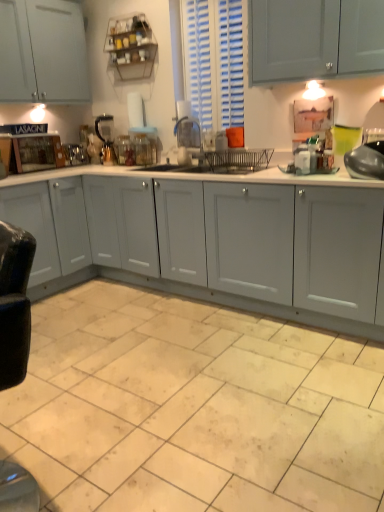
Question: Is shiny metallic pot at right, the fifth appliance in the back-to-front sequence, closer to the viewer compared to teal glass at upper right?

Choices:
 (A) yes
 (B) no

Answer: (A)

Question: Does shiny metallic pot at right, marked as the 1th appliance in a front-to-back arrangement, contain teal glass at upper right?

Choices:
 (A) yes
 (B) no

Answer: (B)

Question: Can you confirm if shiny metallic pot at right, the fifth appliance in the back-to-front sequence, is shorter than teal glass at upper right?

Choices:
 (A) yes
 (B) no

Answer: (A)

Question: Is shiny metallic pot at right, marked as the 1th appliance in a right-to-left arrangement, behind teal glass at upper right?

Choices:
 (A) yes
 (B) no

Answer: (B)

Question: Does shiny metallic pot at right, marked as the 1th appliance in a right-to-left arrangement, turn towards teal glass at upper right?

Choices:
 (A) yes
 (B) no

Answer: (B)

Question: Looking at the image, does metallic silver kettle at center, acting as the second appliance starting from the back, seem bigger or smaller compared to teal glass at upper right?

Choices:
 (A) small
 (B) big

Answer: (B)

Question: Considering the positions of metallic silver kettle at center, which is counted as the 4th appliance, starting from the right, and teal glass at upper right in the image, is metallic silver kettle at center, which is counted as the 4th appliance, starting from the right, wider or thinner than teal glass at upper right?

Choices:
 (A) wide
 (B) thin

Answer: (A)

Question: Considering the positions of metallic silver kettle at center, acting as the second appliance starting from the back, and teal glass at upper right in the image, is metallic silver kettle at center, acting as the second appliance starting from the back, taller or shorter than teal glass at upper right?

Choices:
 (A) short
 (B) tall

Answer: (B)

Question: Does point (96, 130) appear closer or farther from the camera than point (354, 139)?

Choices:
 (A) closer
 (B) farther

Answer: (B)

Question: Considering the positions of shiny metallic pot at right, marked as the 1th appliance in a front-to-back arrangement, and clear glass jar at center, the third appliance viewed from the right, in the image, is shiny metallic pot at right, marked as the 1th appliance in a front-to-back arrangement, bigger or smaller than clear glass jar at center, the third appliance viewed from the right,?

Choices:
 (A) big
 (B) small

Answer: (A)

Question: In terms of height, does shiny metallic pot at right, marked as the 1th appliance in a right-to-left arrangement, look taller or shorter compared to clear glass jar at center, placed as the third appliance when sorted from back to front?

Choices:
 (A) tall
 (B) short

Answer: (B)

Question: Choose the correct answer: Is shiny metallic pot at right, the fifth appliance in the back-to-front sequence, inside clear glass jar at center, the third appliance viewed from the right, or outside it?

Choices:
 (A) outside
 (B) inside

Answer: (A)

Question: Is shiny metallic pot at right, marked as the 1th appliance in a right-to-left arrangement, wider or thinner than clear glass jar at center, placed as the third appliance when sorted from back to front?

Choices:
 (A) wide
 (B) thin

Answer: (A)

Question: Looking at the image, does wooden cutting board at left seem bigger or smaller compared to beige ceramic tile at lower center?

Choices:
 (A) big
 (B) small

Answer: (B)

Question: Do you think wooden cutting board at left is within beige ceramic tile at lower center, or outside of it?

Choices:
 (A) inside
 (B) outside

Answer: (B)